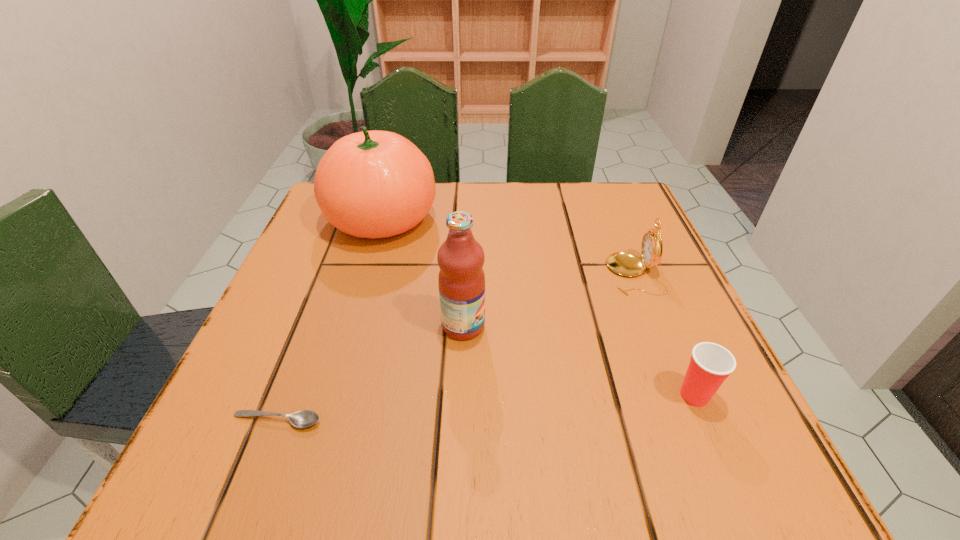
What are the coordinates of `the third object from right to left` in the screenshot? It's located at (461, 280).

Image resolution: width=960 pixels, height=540 pixels. I want to click on fruit juice, so click(461, 280).

Where is `pumpkin`? This screenshot has height=540, width=960. pumpkin is located at coordinates (374, 184).

This screenshot has width=960, height=540. What are the coordinates of `pocket watch` in the screenshot? It's located at (626, 264).

You are a GUI agent. You are given a task and a screenshot of the screen. Output one action in this format:
    pyautogui.click(x=<x>, y=<y>)
    Task: Click on the third tallest object
    This screenshot has width=960, height=540.
    Given the screenshot: What is the action you would take?
    pyautogui.click(x=626, y=264)

In order to click on the second shortest object in this screenshot , I will do `click(710, 364)`.

Where is `the shortest object`? The width and height of the screenshot is (960, 540). the shortest object is located at coordinates (305, 418).

I want to click on vacant region located on the front label of the third object from left to right, so click(x=515, y=326).

Locate an element on the screen. Image resolution: width=960 pixels, height=540 pixels. free space located on the right of the pumpkin is located at coordinates (488, 219).

At what (x,y) coordinates should I click in order to perform the action: click on free space located on the face of the fourth nearest object. Please return your answer as a coordinate pair (x, y). This screenshot has height=540, width=960. Looking at the image, I should click on (566, 274).